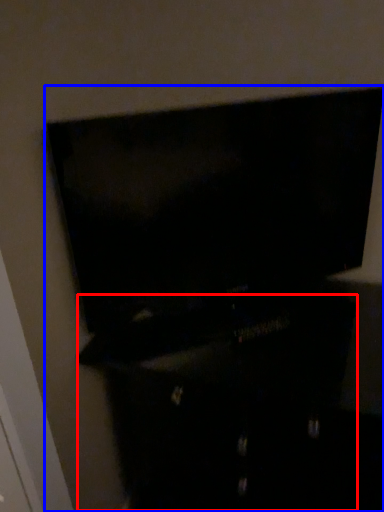
Question: Among these objects, which one is farthest to the camera, dresser (highlighted by a red box) or furniture (highlighted by a blue box)?

Choices:
 (A) dresser
 (B) furniture

Answer: (A)